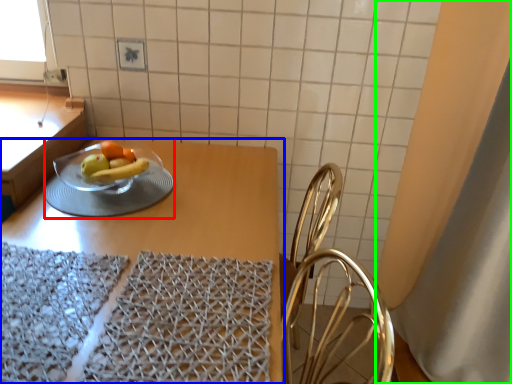
Question: Which is nearer to the tableware (highlighted by a red box)? table (highlighted by a blue box) or curtain (highlighted by a green box).

Choices:
 (A) table
 (B) curtain

Answer: (A)